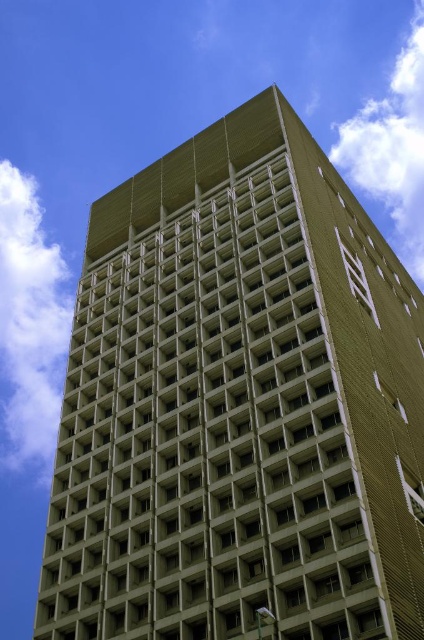
Is white fluffy cloud at upper left further to the viewer compared to white fluffy cloud at upper center?

No, it is in front of white fluffy cloud at upper center.

In the scene shown: Between white fluffy cloud at upper left and white fluffy cloud at upper center, which one appears on the right side from the viewer's perspective?

Positioned to the right is white fluffy cloud at upper center.

Between point (41, 449) and point (396, 164), which one is positioned in front?

Point (41, 449) is more forward.

Find the location of a particular element. white fluffy cloud at upper left is located at coordinates (30, 324).